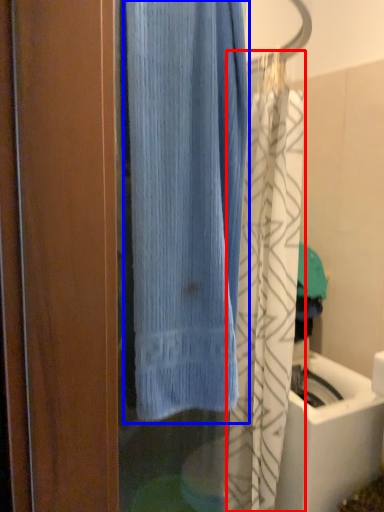
Question: Among these objects, which one is farthest to the camera, shower curtain (highlighted by a red box) or curtain (highlighted by a blue box)?

Choices:
 (A) shower curtain
 (B) curtain

Answer: (A)